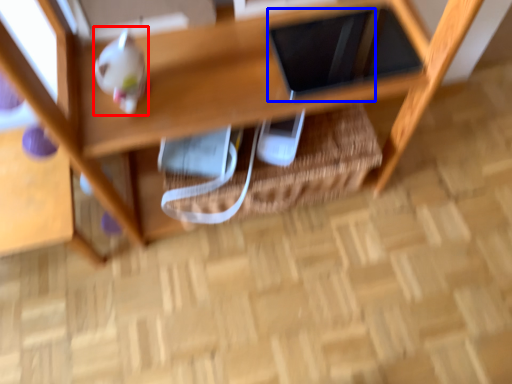
Question: Which point is further to the camera, toy (highlighted by a red box) or tablet computer (highlighted by a blue box)?

Choices:
 (A) toy
 (B) tablet computer

Answer: (B)